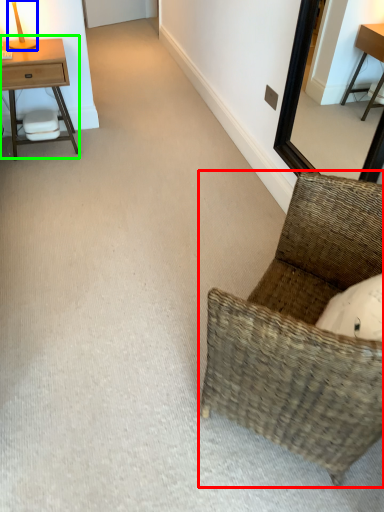
Question: Based on their relative distances, which object is nearer to chair (highlighted by a red box)? Choose from table lamp (highlighted by a blue box) and nightstand (highlighted by a green box).

Choices:
 (A) table lamp
 (B) nightstand

Answer: (B)